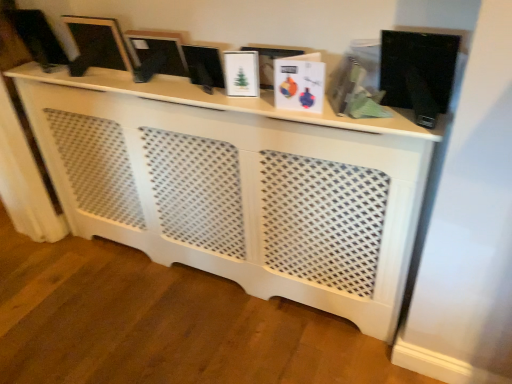
This screenshot has height=384, width=512. What do you see at coordinates (238, 186) in the screenshot? I see `white lattice cabinet at center` at bounding box center [238, 186].

Where is `matte black monitor at upper left, marked as the 3th computer monitor in a right-to-left arrangement`? This screenshot has height=384, width=512. matte black monitor at upper left, marked as the 3th computer monitor in a right-to-left arrangement is located at coordinates (38, 37).

Looking at this image, from a real-world perspective, is matte black frame at upper left, the second computer monitor viewed from the left, positioned above or below white lattice cabinet at center?

matte black frame at upper left, the second computer monitor viewed from the left, is above white lattice cabinet at center.

Does matte black frame at upper left, the second computer monitor viewed from the left, have a greater width compared to white lattice cabinet at center?

In fact, matte black frame at upper left, the second computer monitor viewed from the left, might be narrower than white lattice cabinet at center.

Who is shorter, matte black frame at upper left, the second computer monitor viewed from the left, or white lattice cabinet at center?

matte black frame at upper left, the second computer monitor viewed from the left.

Which object is positioned more to the right, matte black frame at upper left, the second computer monitor viewed from the left, or white lattice cabinet at center?

white lattice cabinet at center is more to the right.

Which object is closer to the camera taking this photo, white lattice cabinet at center or matte black frame at upper left, the second computer monitor viewed from the right?

white lattice cabinet at center is more forward.

You are a GUI agent. You are given a task and a screenshot of the screen. Output one action in this format:
    pyautogui.click(x=<x>, y=<y>)
    Task: Click on the furniture in front of the matte black frame at upper left, the second computer monitor viewed from the left
    Image resolution: width=512 pixels, height=384 pixels.
    Given the screenshot: What is the action you would take?
    pyautogui.click(x=238, y=186)

From their relative heights in the image, would you say white lattice cabinet at center is taller or shorter than matte black frame at upper left, the second computer monitor viewed from the left?

Clearly, white lattice cabinet at center is taller compared to matte black frame at upper left, the second computer monitor viewed from the left.

Between black glossy computer monitor at center, arranged as the 1th computer monitor when viewed from the right, and matte black monitor at upper left, marked as the 3th computer monitor in a right-to-left arrangement, which one has less height?

Standing shorter between the two is black glossy computer monitor at center, arranged as the 1th computer monitor when viewed from the right.

Between black glossy computer monitor at center, arranged as the 1th computer monitor when viewed from the right, and matte black monitor at upper left, marked as the 3th computer monitor in a right-to-left arrangement, which one appears on the left side from the viewer's perspective?

Positioned to the left is matte black monitor at upper left, marked as the 3th computer monitor in a right-to-left arrangement.

Which is in front, point (202, 68) or point (28, 16)?

The point (202, 68) is closer to the camera.

Is black glossy computer monitor at center, arranged as the 1th computer monitor when viewed from the right, outside of matte black monitor at upper left, marked as the 3th computer monitor in a right-to-left arrangement?

Absolutely, black glossy computer monitor at center, arranged as the 1th computer monitor when viewed from the right, is external to matte black monitor at upper left, marked as the 3th computer monitor in a right-to-left arrangement.

From the image's perspective, is matte black frame at upper left, the second computer monitor viewed from the left, under black glossy computer monitor at center, arranged as the 1th computer monitor when viewed from the right?

No.

Does matte black frame at upper left, the second computer monitor viewed from the right, contain black glossy computer monitor at center, which is the 3th computer monitor from left to right?

No.

Can you confirm if matte black frame at upper left, the second computer monitor viewed from the right, is shorter than black glossy computer monitor at center, arranged as the 1th computer monitor when viewed from the right?

No, matte black frame at upper left, the second computer monitor viewed from the right, is not shorter than black glossy computer monitor at center, arranged as the 1th computer monitor when viewed from the right.

Which is more to the right, matte black frame at upper left, the second computer monitor viewed from the right, or black glossy computer monitor at center, arranged as the 1th computer monitor when viewed from the right?

black glossy computer monitor at center, arranged as the 1th computer monitor when viewed from the right, is more to the right.

Can we say white lattice cabinet at center lies outside black glossy computer monitor at center, which is the 3th computer monitor from left to right?

Yes.

Can you tell me how much white lattice cabinet at center and black glossy computer monitor at center, arranged as the 1th computer monitor when viewed from the right, differ in facing direction?

The angle between the facing direction of white lattice cabinet at center and the facing direction of black glossy computer monitor at center, arranged as the 1th computer monitor when viewed from the right, is 2.84 degrees.

Is white lattice cabinet at center at the right side of black glossy computer monitor at center, arranged as the 1th computer monitor when viewed from the right?

No, white lattice cabinet at center is not to the right of black glossy computer monitor at center, arranged as the 1th computer monitor when viewed from the right.

Which is in front, point (200, 244) or point (208, 82)?

The point (208, 82) is more forward.

From the image's perspective, is matte black monitor at upper left, marked as the 3th computer monitor in a right-to-left arrangement, on white lattice cabinet at center?

Correct, matte black monitor at upper left, marked as the 3th computer monitor in a right-to-left arrangement, appears higher than white lattice cabinet at center in the image.

Where is `computer monitor that is the 3rd one when counting backward from the white lattice cabinet at center`? This screenshot has width=512, height=384. computer monitor that is the 3rd one when counting backward from the white lattice cabinet at center is located at coordinates (38, 37).

Does matte black monitor at upper left, marked as the 3th computer monitor in a right-to-left arrangement, have a greater height compared to white lattice cabinet at center?

No, matte black monitor at upper left, marked as the 3th computer monitor in a right-to-left arrangement, is not taller than white lattice cabinet at center.

Between matte black monitor at upper left, which is the 1th computer monitor in left-to-right order, and white lattice cabinet at center, which one has larger size?

white lattice cabinet at center.

Can you tell me how much matte black frame at upper left, the second computer monitor viewed from the right, and matte black monitor at upper left, which is the 1th computer monitor in left-to-right order, differ in facing direction?

The facing directions of matte black frame at upper left, the second computer monitor viewed from the right, and matte black monitor at upper left, which is the 1th computer monitor in left-to-right order, are 0.00819 degrees apart.

Is matte black frame at upper left, the second computer monitor viewed from the left, outside of matte black monitor at upper left, marked as the 3th computer monitor in a right-to-left arrangement?

matte black frame at upper left, the second computer monitor viewed from the left, is positioned outside matte black monitor at upper left, marked as the 3th computer monitor in a right-to-left arrangement.

Can you see matte black frame at upper left, the second computer monitor viewed from the right, touching matte black monitor at upper left, which is the 1th computer monitor in left-to-right order?

There is a gap between matte black frame at upper left, the second computer monitor viewed from the right, and matte black monitor at upper left, which is the 1th computer monitor in left-to-right order.

Relative to matte black monitor at upper left, marked as the 3th computer monitor in a right-to-left arrangement, is matte black frame at upper left, the second computer monitor viewed from the right, in front or behind?

matte black frame at upper left, the second computer monitor viewed from the right, is in front of matte black monitor at upper left, marked as the 3th computer monitor in a right-to-left arrangement.

Identify the location of the 1st computer monitor counting from the left side of the white lattice cabinet at center. Image resolution: width=512 pixels, height=384 pixels. (99, 42).

From the image's perspective, starting from the white lattice cabinet at center, which computer monitor is the 2nd one above? Please provide its 2D coordinates.

[(99, 42)]

From the image, which object appears to be farther from matte black monitor at upper left, which is the 1th computer monitor in left-to-right order, black glossy computer monitor at center, arranged as the 1th computer monitor when viewed from the right, or white lattice cabinet at center?

black glossy computer monitor at center, arranged as the 1th computer monitor when viewed from the right, is positioned further to the anchor matte black monitor at upper left, which is the 1th computer monitor in left-to-right order.

Based on their spatial positions, is matte black monitor at upper left, marked as the 3th computer monitor in a right-to-left arrangement, or black glossy computer monitor at center, arranged as the 1th computer monitor when viewed from the right, further from matte black frame at upper left, the second computer monitor viewed from the left?

The object further to matte black frame at upper left, the second computer monitor viewed from the left, is black glossy computer monitor at center, arranged as the 1th computer monitor when viewed from the right.

Looking at the image, which one is located closer to black glossy computer monitor at center, arranged as the 1th computer monitor when viewed from the right, matte black frame at upper left, the second computer monitor viewed from the left, or white lattice cabinet at center?

Among the two, matte black frame at upper left, the second computer monitor viewed from the left, is located nearer to black glossy computer monitor at center, arranged as the 1th computer monitor when viewed from the right.

Looking at the image, which one is located closer to black glossy computer monitor at center, which is the 3th computer monitor from left to right, matte black monitor at upper left, which is the 1th computer monitor in left-to-right order, or matte black frame at upper left, the second computer monitor viewed from the left?

Based on the image, matte black frame at upper left, the second computer monitor viewed from the left, appears to be nearer to black glossy computer monitor at center, which is the 3th computer monitor from left to right.

Looking at the image, which one is located closer to matte black monitor at upper left, which is the 1th computer monitor in left-to-right order, white lattice cabinet at center or matte black frame at upper left, the second computer monitor viewed from the left?

matte black frame at upper left, the second computer monitor viewed from the left, is closer to matte black monitor at upper left, which is the 1th computer monitor in left-to-right order.

When comparing their distances from white lattice cabinet at center, does matte black monitor at upper left, which is the 1th computer monitor in left-to-right order, or matte black frame at upper left, the second computer monitor viewed from the right, seem closer?

matte black frame at upper left, the second computer monitor viewed from the right, lies closer to white lattice cabinet at center than the other object.

From the image, which object appears to be farther from white lattice cabinet at center, black glossy computer monitor at center, arranged as the 1th computer monitor when viewed from the right, or matte black frame at upper left, the second computer monitor viewed from the right?

matte black frame at upper left, the second computer monitor viewed from the right, lies further to white lattice cabinet at center than the other object.

Estimate the real-world distances between objects in this image. Which object is closer to black glossy computer monitor at center, arranged as the 1th computer monitor when viewed from the right, matte black monitor at upper left, marked as the 3th computer monitor in a right-to-left arrangement, or white lattice cabinet at center?

The object closer to black glossy computer monitor at center, arranged as the 1th computer monitor when viewed from the right, is white lattice cabinet at center.

Where is `computer monitor between matte black monitor at upper left, marked as the 3th computer monitor in a right-to-left arrangement, and black glossy computer monitor at center, which is the 3th computer monitor from left to right, in the horizontal direction`? This screenshot has height=384, width=512. computer monitor between matte black monitor at upper left, marked as the 3th computer monitor in a right-to-left arrangement, and black glossy computer monitor at center, which is the 3th computer monitor from left to right, in the horizontal direction is located at coordinates pyautogui.click(x=99, y=42).

Where is `computer monitor between matte black frame at upper left, the second computer monitor viewed from the left, and white lattice cabinet at center vertically`? The height and width of the screenshot is (384, 512). computer monitor between matte black frame at upper left, the second computer monitor viewed from the left, and white lattice cabinet at center vertically is located at coordinates (204, 66).

Find the location of a particular element. This screenshot has width=512, height=384. furniture between matte black monitor at upper left, which is the 1th computer monitor in left-to-right order, and black glossy computer monitor at center, which is the 3th computer monitor from left to right, in the horizontal direction is located at coordinates (238, 186).